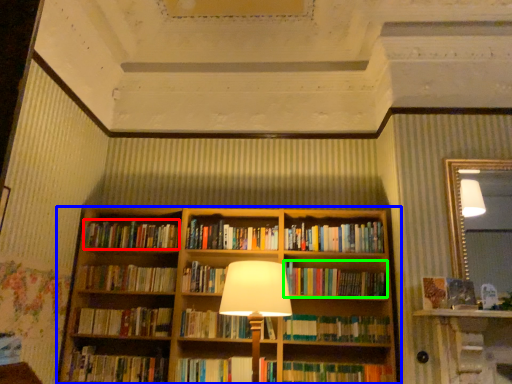
Question: Which object is the farthest from book (highlighted by a red box)? Choose among these: bookcase (highlighted by a blue box) or book (highlighted by a green box).

Choices:
 (A) bookcase
 (B) book

Answer: (B)